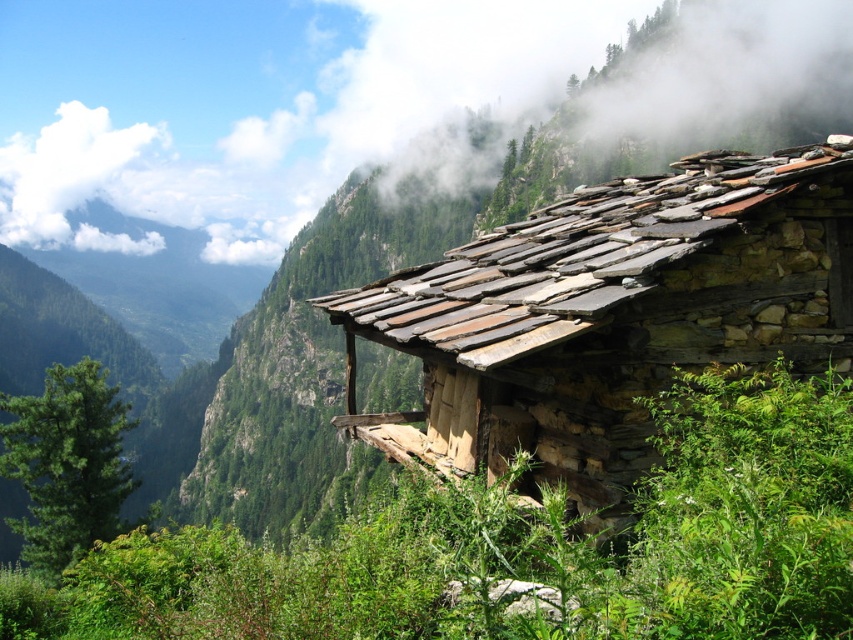
You are standing at the base of the mountain near the rustic stone building and want to take a photo of the green leafy plant at lower center. If your camera has a maximum focus range of 5 meters, will you be able to capture the plant clearly?

The green leafy plant at lower center is 5.55 meters away from the camera. Since the camera can only focus up to 5 meters, it won cannot capture the plant clearly due to the distance exceeding the focus range.

You are standing in front of the rustic stone building and want to locate the point marked at coordinates point (521, 547). Based on the scene description, where would this point be located?

The point (521, 547) is on the green leafy plant at lower center.